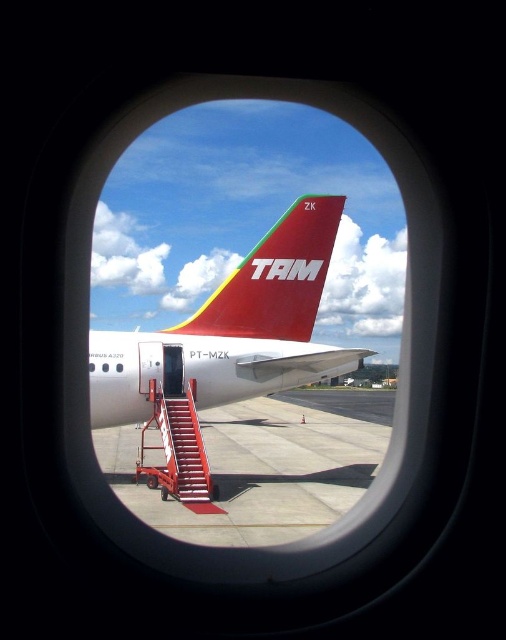
Question: Does shiny red airplane tail at center appear on the right side of metallic red staircase at center?

Choices:
 (A) yes
 (B) no

Answer: (A)

Question: Can you confirm if smooth concrete tarmac at center is positioned below metallic red staircase at center?

Choices:
 (A) yes
 (B) no

Answer: (A)

Question: Which point is farther to the camera?

Choices:
 (A) (203, 500)
 (B) (219, 515)
 (C) (282, 280)

Answer: (C)

Question: Which point is closer to the camera taking this photo?

Choices:
 (A) (175, 472)
 (B) (271, 240)
 (C) (283, 324)

Answer: (A)

Question: Among these points, which one is farthest from the camera?

Choices:
 (A) click(x=150, y=500)
 (B) click(x=180, y=442)
 (C) click(x=304, y=241)

Answer: (C)

Question: Can you confirm if smooth concrete tarmac at center is positioned to the left of shiny red airplane tail at center?

Choices:
 (A) yes
 (B) no

Answer: (A)